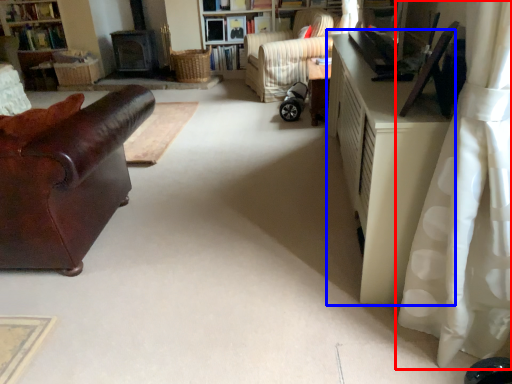
Question: Which point is closer to the camera, curtain (highlighted by a red box) or cabinetry (highlighted by a blue box)?

Choices:
 (A) curtain
 (B) cabinetry

Answer: (A)